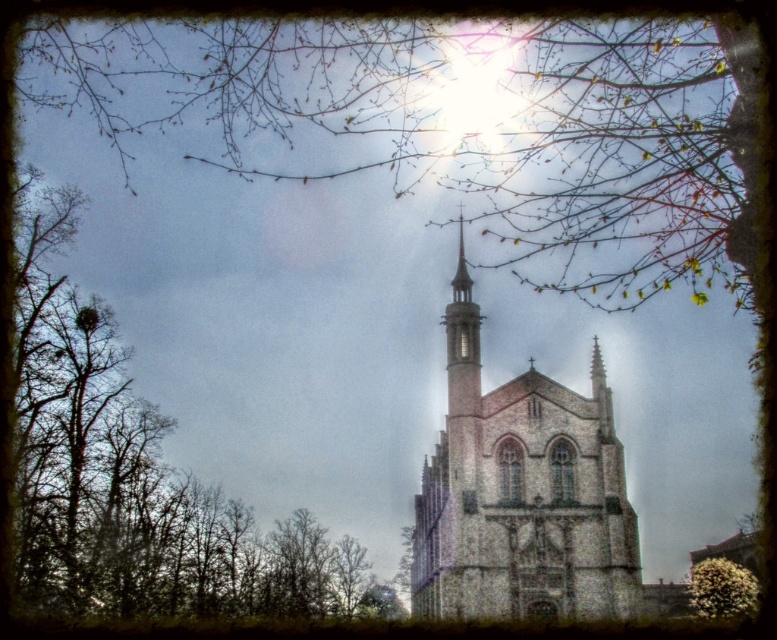
Measure the distance from smooth stone spire at center to green fuzzy bush at lower right.

smooth stone spire at center and green fuzzy bush at lower right are 144.03 feet apart from each other.

Can you confirm if smooth stone spire at center is wider than green fuzzy bush at lower right?

No.

Describe the element at coordinates (462, 342) in the screenshot. I see `smooth stone spire at center` at that location.

The image size is (777, 640). I want to click on smooth stone spire at center, so click(462, 342).

Between brick stone tower at center and green fuzzy bush at lower right, which one appears on the right side from the viewer's perspective?

green fuzzy bush at lower right

Can you confirm if brick stone tower at center is positioned above green fuzzy bush at lower right?

Yes.

Is point (531, 492) farther from viewer compared to point (732, 563)?

No, it is not.

This screenshot has width=777, height=640. Find the location of `brick stone tower at center`. brick stone tower at center is located at coordinates (521, 493).

Who is lower down, brown leafless tree at left or brick stone tower at center?

brick stone tower at center is below.

Does point (375, 596) come in front of point (504, 536)?

That is False.

Between point (33, 493) and point (596, 476), which one is positioned behind?

Point (33, 493)

Image resolution: width=777 pixels, height=640 pixels. Identify the location of brown leafless tree at left. (138, 476).